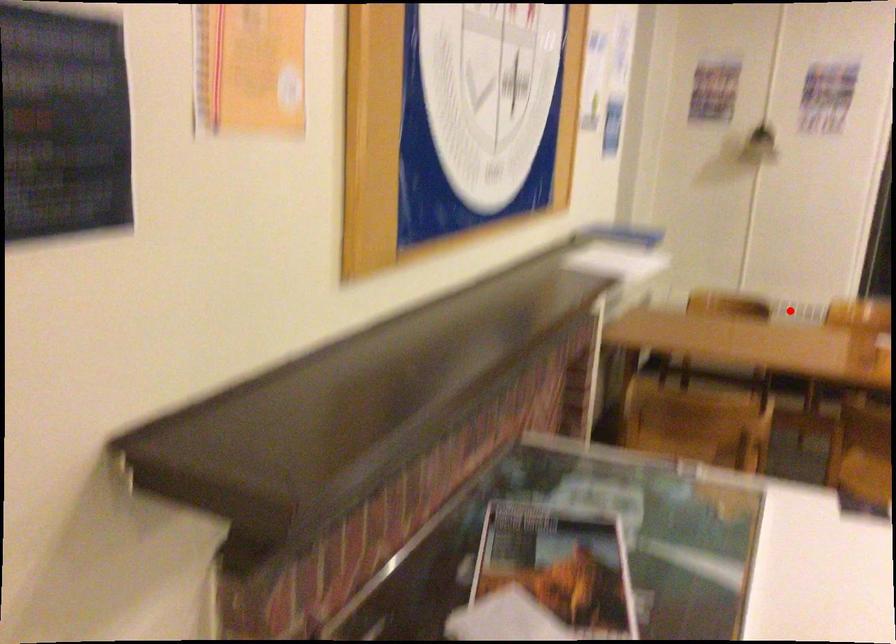
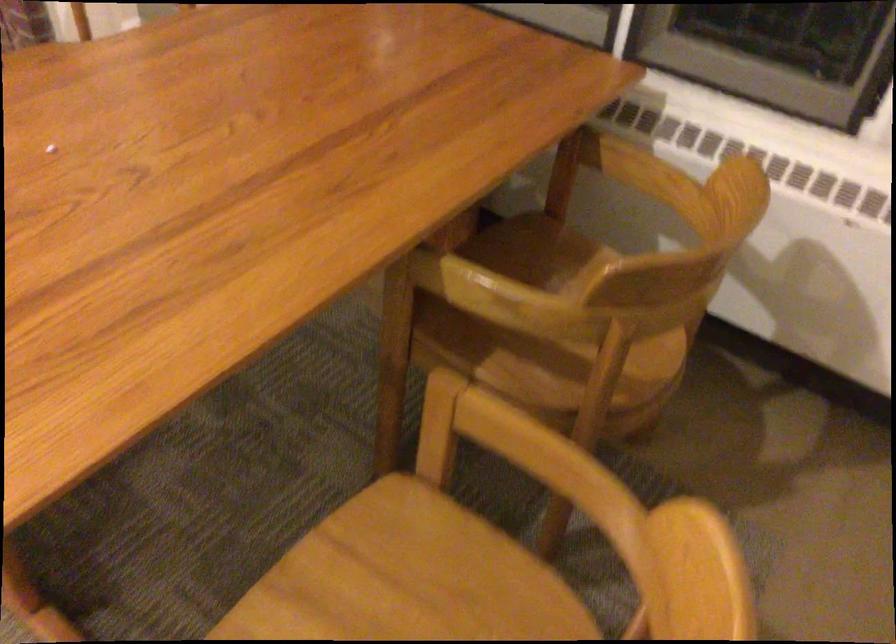
The point at the highlighted location is marked in the first image. Where is the corresponding point in the second image?

(501, 440)